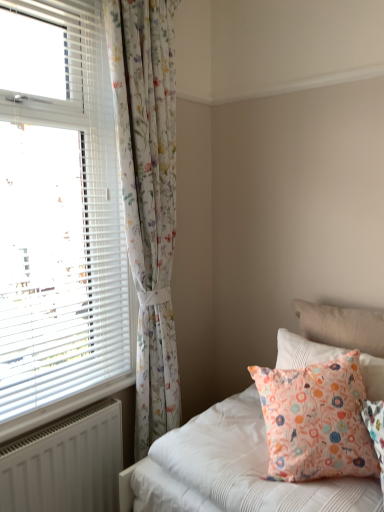
Describe the element at coordinates (302, 351) in the screenshot. I see `floral fabric pillow at upper right, the first pillow viewed from the back` at that location.

You are a GUI agent. You are given a task and a screenshot of the screen. Output one action in this format:
    pyautogui.click(x=<x>, y=<y>)
    Task: Click on the white matte radiator at lower left
    This screenshot has width=384, height=512.
    Given the screenshot: What is the action you would take?
    pyautogui.click(x=66, y=464)

Identify the location of white plastic blinds at left. (81, 243).

Where is `white plastic radiator at lower left`? Image resolution: width=384 pixels, height=512 pixels. white plastic radiator at lower left is located at coordinates (62, 408).

From the image's perspective, which is above, floral fabric pillow at upper right, the first pillow viewed from the back, or peach fabric pillow at lower right, which is the second pillow in back-to-front order?

floral fabric pillow at upper right, the first pillow viewed from the back, from the image's perspective.

Is point (306, 346) closer to viewer compared to point (343, 383)?

No, (306, 346) is further to viewer.

In terms of height, does floral fabric pillow at upper right, which is counted as the 2th pillow, starting from the front, look taller or shorter compared to peach fabric pillow at lower right, the first pillow from the front?

floral fabric pillow at upper right, which is counted as the 2th pillow, starting from the front, is taller than peach fabric pillow at lower right, the first pillow from the front.

Which object is wider, white plastic radiator at lower left or floral fabric pillow at upper right, the first pillow viewed from the back?

floral fabric pillow at upper right, the first pillow viewed from the back, is wider.

I want to click on pillow behind the white plastic radiator at lower left, so click(302, 351).

From the image's perspective, is white plastic radiator at lower left positioned above or below floral fabric pillow at upper right, the first pillow viewed from the back?

Based on their image positions, white plastic radiator at lower left is located beneath floral fabric pillow at upper right, the first pillow viewed from the back.

Is the position of floral fabric pillow at upper right, the first pillow viewed from the back, more distant than that of white matte radiator at lower left?

That is True.

Is floral fabric pillow at upper right, which is counted as the 2th pillow, starting from the front, in contact with white matte radiator at lower left?

No, floral fabric pillow at upper right, which is counted as the 2th pillow, starting from the front, is not touching white matte radiator at lower left.

Looking at this image, considering the sizes of objects floral fabric pillow at upper right, which is counted as the 2th pillow, starting from the front, and white matte radiator at lower left in the image provided, who is shorter, floral fabric pillow at upper right, which is counted as the 2th pillow, starting from the front, or white matte radiator at lower left?

floral fabric pillow at upper right, which is counted as the 2th pillow, starting from the front, is shorter.

Is floral fabric pillow at upper right, which is counted as the 2th pillow, starting from the front, bigger than white matte radiator at lower left?

Indeed, floral fabric pillow at upper right, which is counted as the 2th pillow, starting from the front, has a larger size compared to white matte radiator at lower left.

Locate an element on the screen. radiator in front of the white plastic radiator at lower left is located at coordinates coord(66,464).

From the image's perspective, which one is positioned lower, white plastic radiator at lower left or white matte radiator at lower left?

From the image's view, white matte radiator at lower left is below.

Is white plastic radiator at lower left surrounding white matte radiator at lower left?

No, white matte radiator at lower left is not surrounded by white plastic radiator at lower left.

Does white plastic radiator at lower left have a greater height compared to white matte radiator at lower left?

No, white plastic radiator at lower left is not taller than white matte radiator at lower left.

Looking at their sizes, would you say white plastic blinds at left is wider or thinner than white matte radiator at lower left?

white plastic blinds at left is wider than white matte radiator at lower left.

From a real-world perspective, relative to white matte radiator at lower left, is white plastic blinds at left vertically above or below?

From a real-world perspective, white plastic blinds at left is physically above white matte radiator at lower left.

Can you tell me how much white plastic blinds at left and white matte radiator at lower left differ in facing direction?

0.0464 degrees separate the facing orientations of white plastic blinds at left and white matte radiator at lower left.

Which object is positioned more to the right, white plastic blinds at left or white matte radiator at lower left?

white matte radiator at lower left is more to the right.

How distant is peach fabric pillow at lower right, the first pillow from the front, from white plastic blinds at left?

peach fabric pillow at lower right, the first pillow from the front, is 33.92 inches from white plastic blinds at left.

Considering the relative positions of peach fabric pillow at lower right, which is the second pillow in back-to-front order, and white plastic blinds at left in the image provided, is peach fabric pillow at lower right, which is the second pillow in back-to-front order, behind white plastic blinds at left?

No, peach fabric pillow at lower right, which is the second pillow in back-to-front order, is in front of white plastic blinds at left.

Is peach fabric pillow at lower right, the first pillow from the front, in contact with white plastic blinds at left?

No, peach fabric pillow at lower right, the first pillow from the front, is not touching white plastic blinds at left.

Considering the positions of objects peach fabric pillow at lower right, which is the second pillow in back-to-front order, and white plastic blinds at left in the image provided, who is more to the left, peach fabric pillow at lower right, which is the second pillow in back-to-front order, or white plastic blinds at left?

From the viewer's perspective, white plastic blinds at left appears more on the left side.

Is white plastic radiator at lower left with peach fabric pillow at lower right, the first pillow from the front?

No, white plastic radiator at lower left is not making contact with peach fabric pillow at lower right, the first pillow from the front.

From the image's perspective, is white plastic radiator at lower left on top of peach fabric pillow at lower right, which is the second pillow in back-to-front order?

Actually, white plastic radiator at lower left appears below peach fabric pillow at lower right, which is the second pillow in back-to-front order, in the image.

Where is `window sill located behind the peach fabric pillow at lower right, which is the second pillow in back-to-front order`? The width and height of the screenshot is (384, 512). window sill located behind the peach fabric pillow at lower right, which is the second pillow in back-to-front order is located at coordinates (62, 408).

Is white plastic radiator at lower left bigger than peach fabric pillow at lower right, the first pillow from the front?

Actually, white plastic radiator at lower left might be smaller than peach fabric pillow at lower right, the first pillow from the front.

The height and width of the screenshot is (512, 384). In order to click on pillow that appears above the peach fabric pillow at lower right, which is the second pillow in back-to-front order (from the image's perspective) in this screenshot , I will do `click(302, 351)`.

Locate an element on the screen. window sill below the floral fabric pillow at upper right, the first pillow viewed from the back (from a real-world perspective) is located at coordinates (62, 408).

When comparing their distances from floral fabric pillow at upper right, the first pillow viewed from the back, does peach fabric pillow at lower right, which is the second pillow in back-to-front order, or white matte radiator at lower left seem further?

white matte radiator at lower left.

Estimate the real-world distances between objects in this image. Which object is closer to white matte radiator at lower left, white plastic radiator at lower left or peach fabric pillow at lower right, the first pillow from the front?

white plastic radiator at lower left.

Estimate the real-world distances between objects in this image. Which object is closer to white plastic blinds at left, floral fabric pillow at upper right, which is counted as the 2th pillow, starting from the front, or peach fabric pillow at lower right, the first pillow from the front?

peach fabric pillow at lower right, the first pillow from the front, is closer to white plastic blinds at left.

Estimate the real-world distances between objects in this image. Which object is closer to white plastic blinds at left, peach fabric pillow at lower right, which is the second pillow in back-to-front order, or white matte radiator at lower left?

white matte radiator at lower left is positioned closer to the anchor white plastic blinds at left.

In the scene shown: When comparing their distances from white plastic radiator at lower left, does peach fabric pillow at lower right, the first pillow from the front, or floral fabric pillow at upper right, the first pillow viewed from the back, seem closer?

peach fabric pillow at lower right, the first pillow from the front, is closer to white plastic radiator at lower left.

Based on their spatial positions, is white plastic blinds at left or white plastic radiator at lower left closer to peach fabric pillow at lower right, the first pillow from the front?

white plastic radiator at lower left is positioned closer to the anchor peach fabric pillow at lower right, the first pillow from the front.

Estimate the real-world distances between objects in this image. Which object is further from floral fabric pillow at upper right, the first pillow viewed from the back, white plastic radiator at lower left or white plastic blinds at left?

Among the two, white plastic blinds at left is located further to floral fabric pillow at upper right, the first pillow viewed from the back.

When comparing their distances from white plastic radiator at lower left, does white matte radiator at lower left or white plastic blinds at left seem closer?

Based on the image, white matte radiator at lower left appears to be nearer to white plastic radiator at lower left.

The width and height of the screenshot is (384, 512). Find the location of `window sill between white plastic blinds at left and white matte radiator at lower left in the up-down direction`. window sill between white plastic blinds at left and white matte radiator at lower left in the up-down direction is located at coordinates (62, 408).

You are a GUI agent. You are given a task and a screenshot of the screen. Output one action in this format:
    pyautogui.click(x=<x>, y=<y>)
    Task: Click on the radiator located between white plastic blinds at left and floral fabric pillow at upper right, which is counted as the 2th pillow, starting from the front, in the left-right direction
    The image size is (384, 512).
    Given the screenshot: What is the action you would take?
    pyautogui.click(x=66, y=464)

I want to click on window sill between white plastic blinds at left and floral fabric pillow at upper right, the first pillow viewed from the back, in the horizontal direction, so click(x=62, y=408).

This screenshot has height=512, width=384. I want to click on window sill between white plastic blinds at left and peach fabric pillow at lower right, which is the second pillow in back-to-front order, from left to right, so click(62, 408).